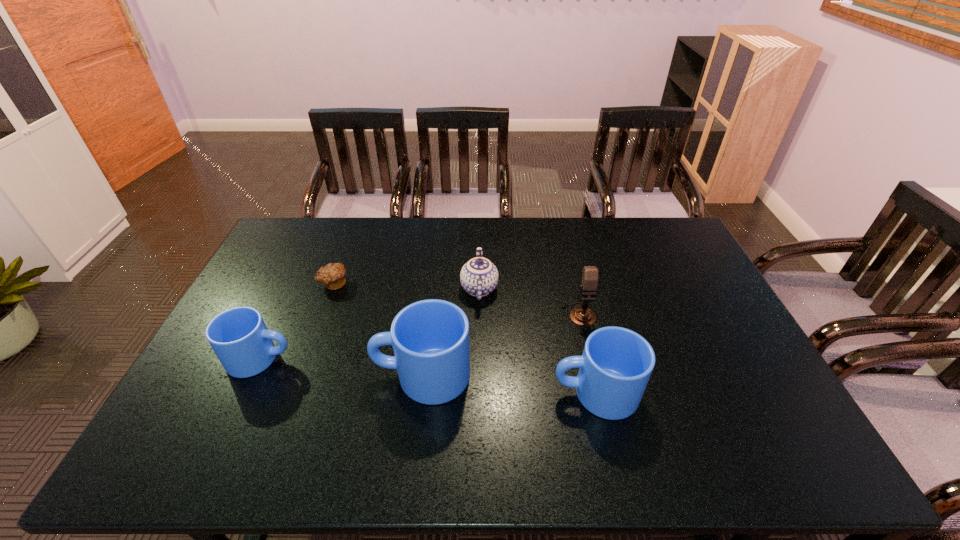
Observe the arrangement of all mugs in the image. To keep them evenly spaced, where would you place another mug on the right? Please locate a free space. Please provide its 2D coordinates. Your answer should be formatted as a tuple, i.e. [(x, y)], where the tuple contains the x and y coordinates of a point satisfying the conditions above.

[(782, 411)]